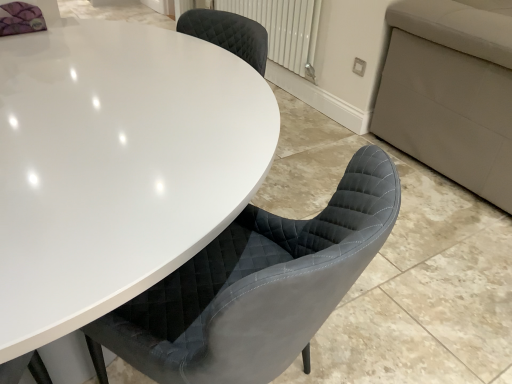
Where is `white textured radiator at upper center`? This screenshot has width=512, height=384. white textured radiator at upper center is located at coordinates (283, 28).

What is the approximate width of white textured radiator at upper center?

white textured radiator at upper center is 12.61 centimeters wide.

What do you see at coordinates (283, 28) in the screenshot? I see `white textured radiator at upper center` at bounding box center [283, 28].

Where is `white glossy table at center`? The image size is (512, 384). white glossy table at center is located at coordinates (116, 166).

Measure the distance between point (118, 262) and camera.

Point (118, 262) and camera are 25.47 inches apart.

Describe the element at coordinates (116, 166) in the screenshot. I see `white glossy table at center` at that location.

At what (x,y) coordinates should I click in order to perform the action: click on white textured radiator at upper center. Please return your answer as a coordinate pair (x, y). Image resolution: width=512 pixels, height=384 pixels. Looking at the image, I should click on (283, 28).

Considering the positions of objects white textured radiator at upper center and white glossy table at center in the image provided, who is more to the right, white textured radiator at upper center or white glossy table at center?

white textured radiator at upper center is more to the right.

Between white textured radiator at upper center and white glossy table at center, which one is positioned behind?

white textured radiator at upper center is more distant.

Is point (309, 77) positioned before point (253, 136)?

That is False.

From the image's perspective, relative to white glossy table at center, is white textured radiator at upper center above or below?

white textured radiator at upper center is above white glossy table at center.

From a real-world perspective, who is located lower, white textured radiator at upper center or white glossy table at center?

white glossy table at center is physically lower.

Between white textured radiator at upper center and white glossy table at center, which one has larger width?

white glossy table at center is wider.

Considering the relative sizes of white textured radiator at upper center and white glossy table at center in the image provided, is white textured radiator at upper center taller than white glossy table at center?

Incorrect, the height of white textured radiator at upper center is not larger of that of white glossy table at center.

Can you confirm if white textured radiator at upper center is smaller than white glossy table at center?

Correct, white textured radiator at upper center occupies less space than white glossy table at center.

Is white textured radiator at upper center situated inside white glossy table at center or outside?

white textured radiator at upper center is not inside white glossy table at center, it's outside.

Is the surface of white textured radiator at upper center in direct contact with white glossy table at center?

No, white textured radiator at upper center is not next to white glossy table at center.

Is white textured radiator at upper center looking in the opposite direction of white glossy table at center?

No, white textured radiator at upper center's orientation is not away from white glossy table at center.

Can you tell me how much white textured radiator at upper center and white glossy table at center differ in facing direction?

67.9 degrees.

How much distance is there between white textured radiator at upper center and white glossy table at center?

They are 1.62 meters apart.

I want to click on table in front of the white textured radiator at upper center, so click(x=116, y=166).

Considering the relative positions of white glossy table at center and white textured radiator at upper center in the image provided, is white glossy table at center to the left of white textured radiator at upper center from the viewer's perspective?

Correct, you'll find white glossy table at center to the left of white textured radiator at upper center.

Consider the image. Does white glossy table at center come in front of white textured radiator at upper center?

Yes, white glossy table at center is closer to the viewer.

Between point (116, 24) and point (290, 3), which one is positioned behind?

Point (290, 3)

From the image's perspective, is white glossy table at center positioned above or below white textured radiator at upper center?

Based on their image positions, white glossy table at center is located beneath white textured radiator at upper center.

From a real-world perspective, who is located higher, white glossy table at center or white textured radiator at upper center?

white textured radiator at upper center is physically above.

Consider the image. Considering the sizes of objects white glossy table at center and white textured radiator at upper center in the image provided, who is wider, white glossy table at center or white textured radiator at upper center?

white glossy table at center.

From their relative heights in the image, would you say white glossy table at center is taller or shorter than white textured radiator at upper center?

In the image, white glossy table at center appears to be taller than white textured radiator at upper center.

Considering the sizes of objects white glossy table at center and white textured radiator at upper center in the image provided, who is smaller, white glossy table at center or white textured radiator at upper center?

With smaller size is white textured radiator at upper center.

Which is correct: white glossy table at center is inside white textured radiator at upper center, or outside of it?

white glossy table at center exists outside the volume of white textured radiator at upper center.

Would you consider white glossy table at center to be distant from white textured radiator at upper center?

Yes, white glossy table at center and white textured radiator at upper center are quite far apart.

Is white textured radiator at upper center at the back of white glossy table at center?

white glossy table at center does not have its back to white textured radiator at upper center.

You are a GUI agent. You are given a task and a screenshot of the screen. Output one action in this format:
    pyautogui.click(x=<x>, y=<y>)
    Task: Click on the table that appears below the white textured radiator at upper center (from the image's perspective)
    The width and height of the screenshot is (512, 384).
    Given the screenshot: What is the action you would take?
    pyautogui.click(x=116, y=166)

Find the location of a particular element. Image resolution: width=512 pixels, height=384 pixels. table that is on the left side of white textured radiator at upper center is located at coordinates (116, 166).

Find the location of `radiator located above the white glossy table at center (from the image's perspective)`. radiator located above the white glossy table at center (from the image's perspective) is located at coordinates (283, 28).